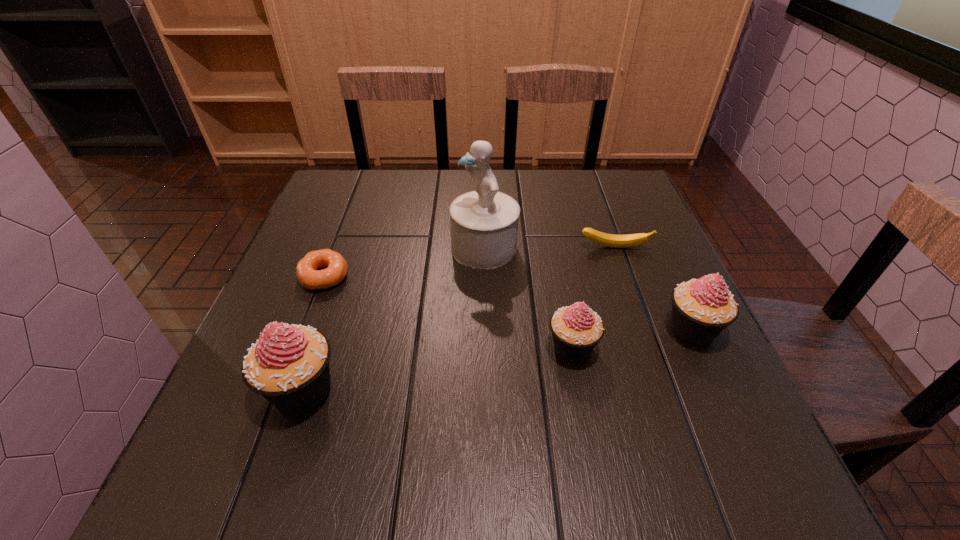
At what (x,y) coordinates should I click in order to perform the action: click on cupcake situated at the right edge. Please return your answer as a coordinate pair (x, y). The image size is (960, 540). Looking at the image, I should click on (702, 308).

You are a GUI agent. You are given a task and a screenshot of the screen. Output one action in this format:
    pyautogui.click(x=<x>, y=<y>)
    Task: Click on the banana present at the right edge
    This screenshot has height=540, width=960.
    Given the screenshot: What is the action you would take?
    pyautogui.click(x=610, y=240)

Where is `object present at the near left corner`? This screenshot has height=540, width=960. object present at the near left corner is located at coordinates (289, 365).

In the image, there is a desktop. Identify the location of free space at the far edge. Image resolution: width=960 pixels, height=540 pixels. (433, 189).

Locate an element on the screen. The width and height of the screenshot is (960, 540). vacant area at the near edge is located at coordinates (325, 401).

This screenshot has height=540, width=960. In order to click on vacant space at the left edge in this screenshot , I will do `click(329, 338)`.

Identify the location of free space at the right edge. pyautogui.click(x=649, y=277).

Identify the location of free space at the near right corner of the desktop. The height and width of the screenshot is (540, 960). (749, 426).

Locate an element on the screen. This screenshot has height=540, width=960. free space between the leftmost cupcake and the banana is located at coordinates (458, 319).

Locate an element on the screen. vacant point located between the second shortest cupcake and the fifth tallest object is located at coordinates (653, 289).